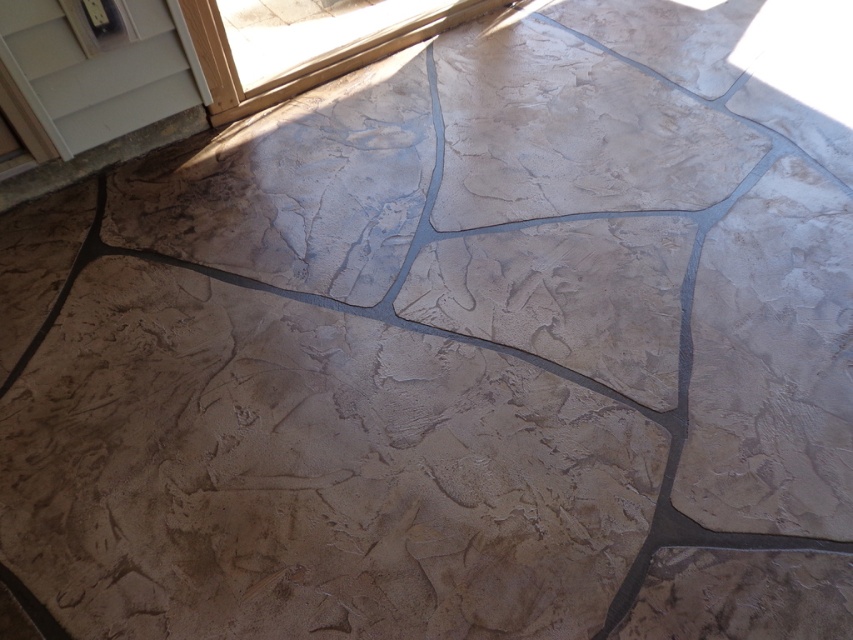
You are a GUI agent. You are given a task and a screenshot of the screen. Output one action in this format:
    pyautogui.click(x=<x>, y=<y>)
    Task: Click on the white painted wood screen door at upper left
    Image resolution: width=853 pixels, height=640 pixels.
    Given the screenshot: What is the action you would take?
    [99, 68]

Is point (62, 36) positioned after point (231, 72)?

No.

Image resolution: width=853 pixels, height=640 pixels. Describe the element at coordinates (99, 68) in the screenshot. I see `white painted wood screen door at upper left` at that location.

This screenshot has height=640, width=853. Find the location of `white painted wood screen door at upper left`. white painted wood screen door at upper left is located at coordinates (99, 68).